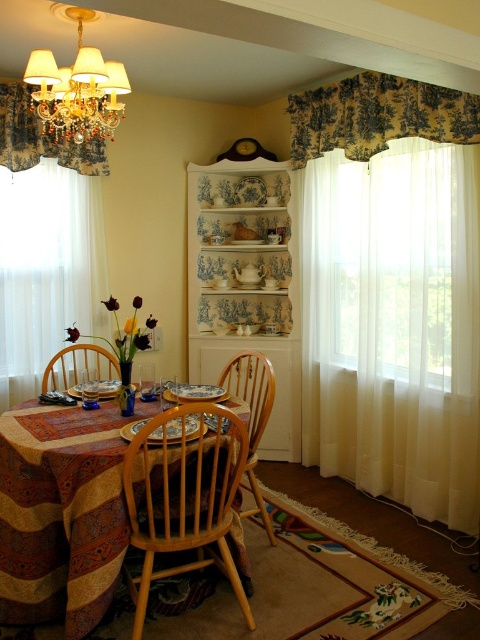
You are sitting in the wooden chair at center and want to reach the toile fabric valance at upper right. Can you touch it without moving from your seat?

The wooden chair at center is behind the toile fabric valance at upper right, so you cannot touch it without moving from your seat because it is in front of you.

You are standing in the dining room and want to place a small decorative item on the table. You have two points marked on the table surface where you can place it. The first point is at coordinate point (338, 109) and the second is at point (266, 412). Which point is closer to you when looking at the table from your current position?

Point (338, 109) is further to the camera than point (266, 412), so the point closer to you would be point (266, 412).